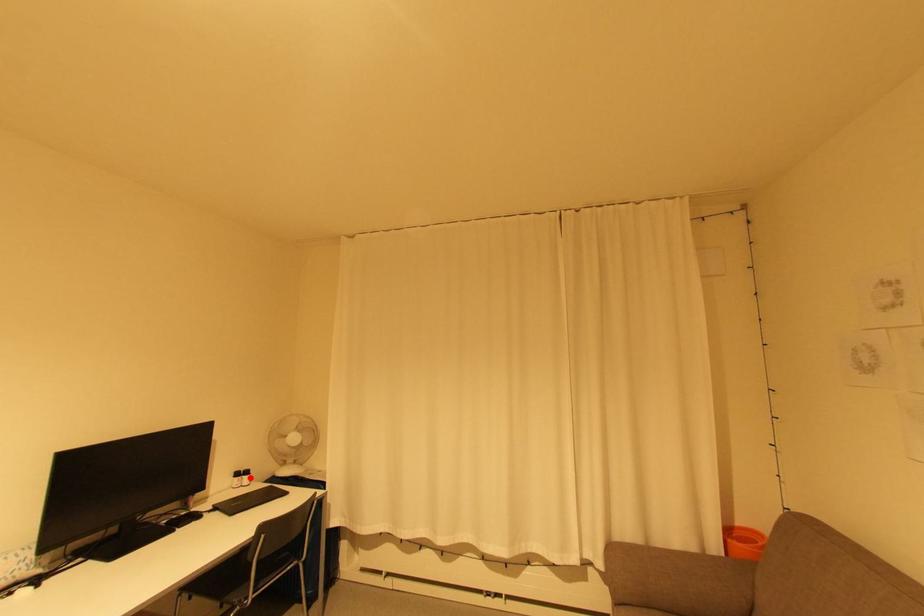
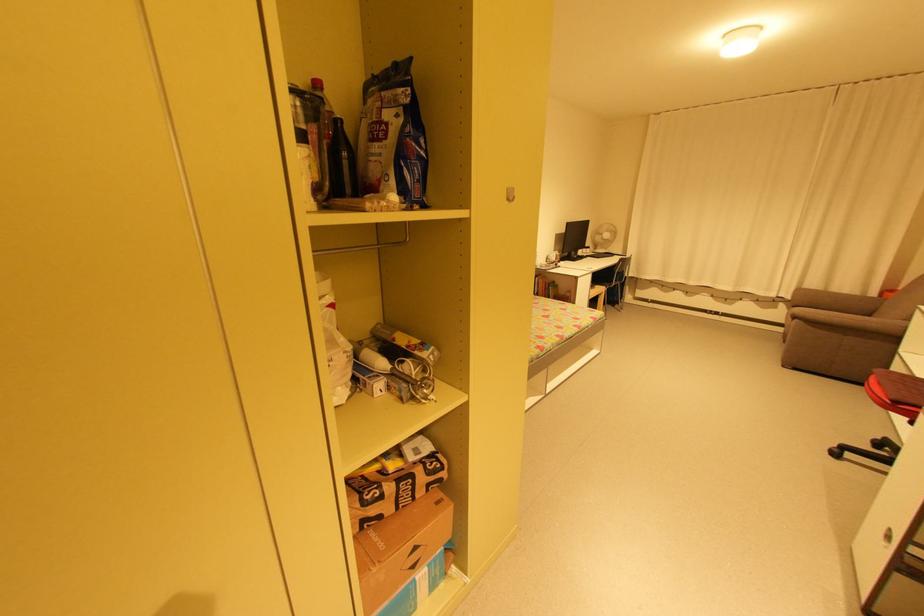
Question: I am providing you with two images of the same scene from different viewpoints. A red point is marked on the first image. Is the red point's position out of view in image 2?

Choices:
 (A) Yes
 (B) No

Answer: (B)